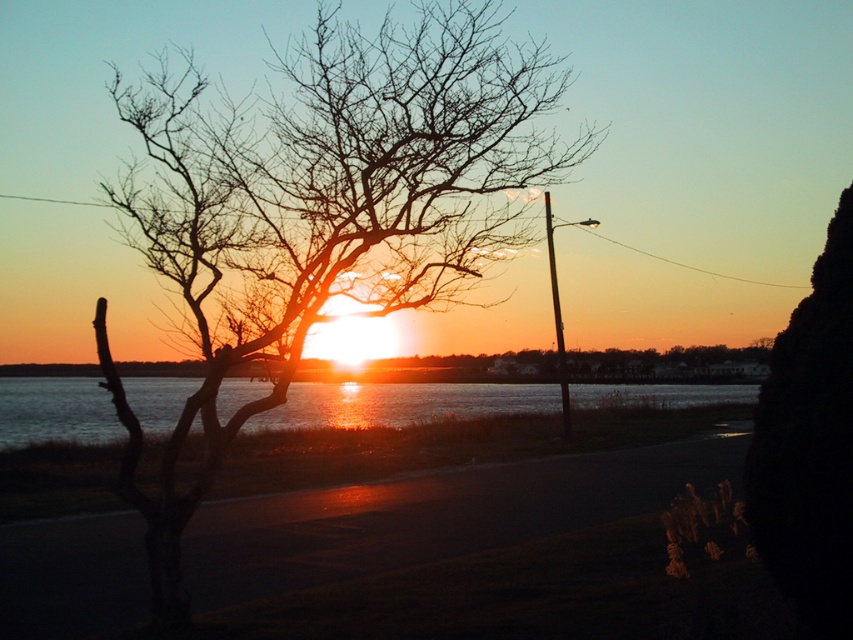
Does bare branches at left have a greater height compared to shiny reflective water at center?

Yes.

Can you confirm if bare branches at left is positioned to the left of shiny reflective water at center?

Correct, you'll find bare branches at left to the left of shiny reflective water at center.

Does point (292, 260) lie behind point (140, 385)?

No, it is in front of (140, 385).

This screenshot has height=640, width=853. Find the location of `bare branches at left`. bare branches at left is located at coordinates (323, 205).